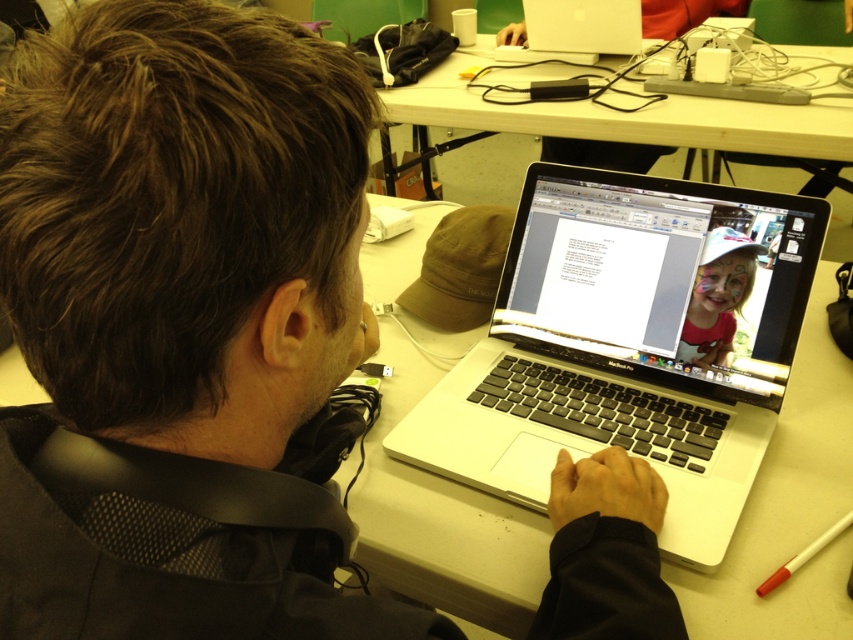
Between silver/black plastic laptop at center and red plastic pen at lower right, which one appears on the left side from the viewer's perspective?

silver/black plastic laptop at center is more to the left.

Which is in front, point (585, 388) or point (778, 566)?

Point (778, 566) is more forward.

You are a GUI agent. You are given a task and a screenshot of the screen. Output one action in this format:
    pyautogui.click(x=<x>, y=<y>)
    Task: Click on the silver/black plastic laptop at center
    The image size is (853, 640).
    Given the screenshot: What is the action you would take?
    pyautogui.click(x=630, y=344)

Consider the image. Does silver/black plastic laptop at center appear on the left side of matte plastic girl at center?

Yes, silver/black plastic laptop at center is to the left of matte plastic girl at center.

Does silver/black plastic laptop at center lie in front of matte plastic girl at center?

Yes.

Is point (582, 186) closer to viewer compared to point (730, 300)?

That is False.

You are a GUI agent. You are given a task and a screenshot of the screen. Output one action in this format:
    pyautogui.click(x=<x>, y=<y>)
    Task: Click on the silver/black plastic laptop at center
    
    Given the screenshot: What is the action you would take?
    pyautogui.click(x=630, y=344)

Can you confirm if white plastic table at upper center is positioned below matte plastic girl at center?

No, white plastic table at upper center is not below matte plastic girl at center.

Between white plastic table at upper center and matte plastic girl at center, which one has less height?

With less height is matte plastic girl at center.

Find the location of a particular element. white plastic table at upper center is located at coordinates (625, 116).